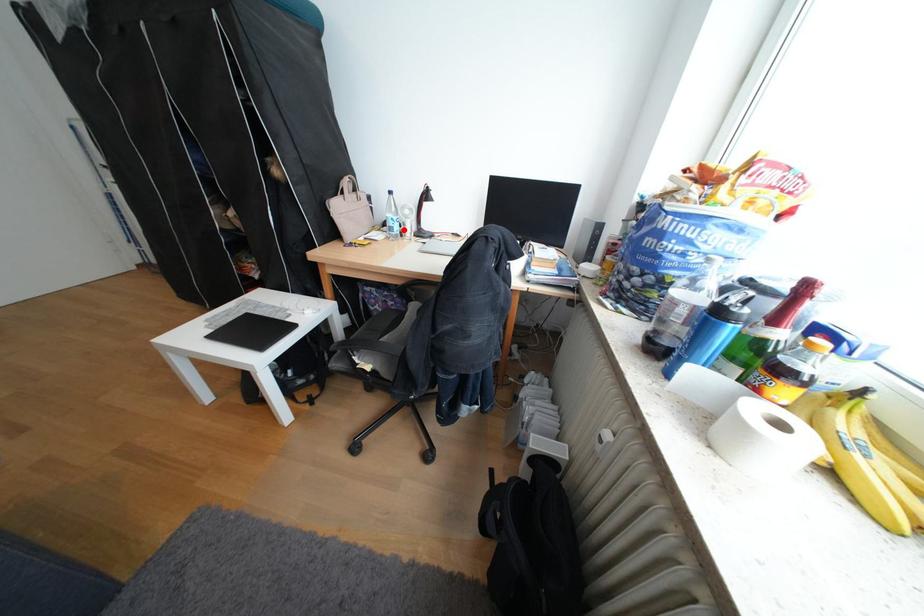
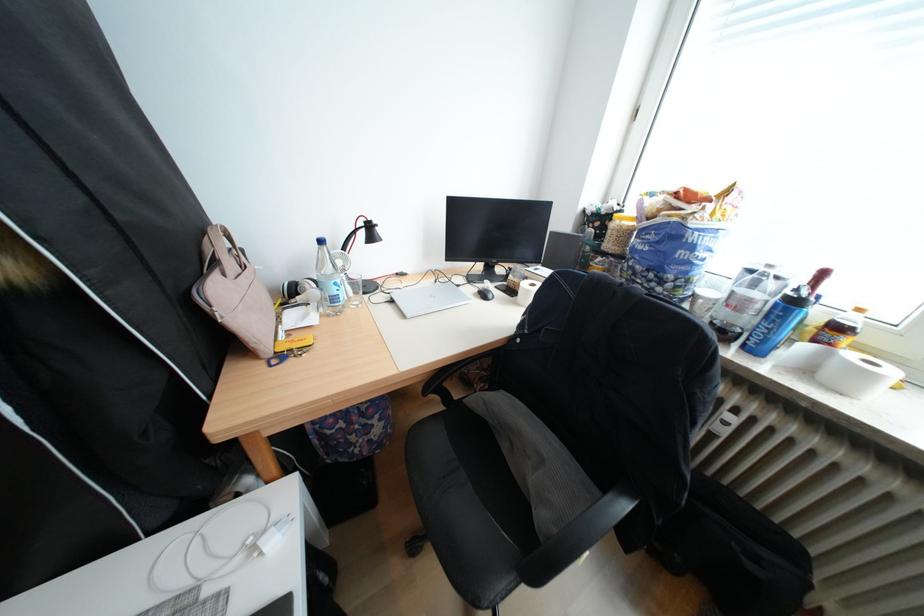
The point at the highlighted location is marked in the first image. Where is the corresponding point in the second image?

(346, 300)